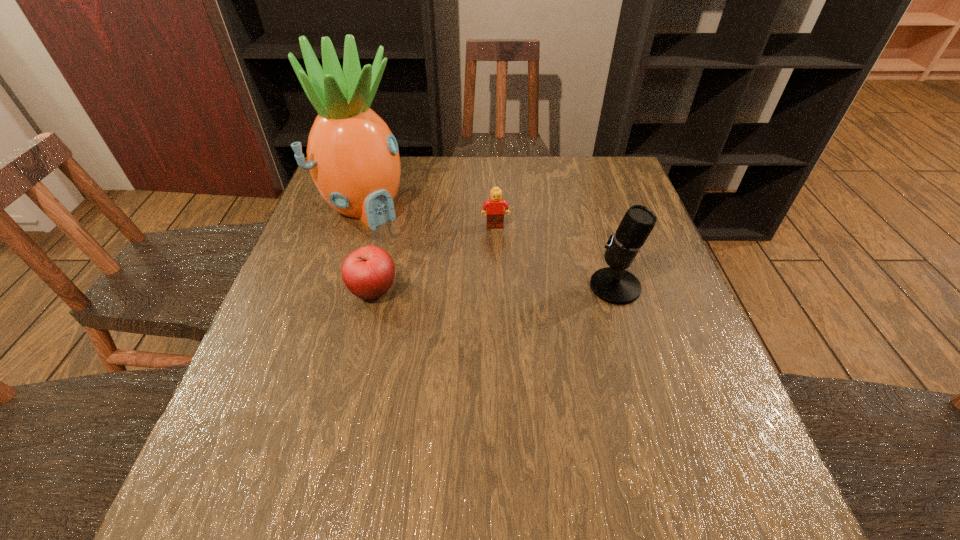
Find the location of a particular element. This screenshot has width=960, height=540. free space at the right edge of the desktop is located at coordinates (626, 348).

Where is `vacant space at the far right corner of the desktop`? The height and width of the screenshot is (540, 960). vacant space at the far right corner of the desktop is located at coordinates (592, 180).

I want to click on blank region between the apple and the Lego, so click(x=434, y=259).

This screenshot has height=540, width=960. I want to click on vacant space that's between the apple and the third object from left to right, so click(434, 259).

At what (x,y) coordinates should I click in order to perform the action: click on free space that is in between the Lego and the microphone. Please return your answer as a coordinate pair (x, y). The image size is (960, 540). Looking at the image, I should click on (555, 256).

Identify the location of free area in between the microphone and the apple. This screenshot has height=540, width=960. (494, 289).

The width and height of the screenshot is (960, 540). Identify the location of free space between the second object from right to left and the apple. (434, 259).

Find the location of a particular element. This screenshot has height=540, width=960. free space between the microphone and the tallest object is located at coordinates (490, 245).

Find the location of a particular element. The width and height of the screenshot is (960, 540). vacant space that's between the tallest object and the second object from right to left is located at coordinates (430, 215).

Identify which object is the second nearest to the pineapple. Please provide its 2D coordinates. Your answer should be formatted as a tuple, i.e. [(x, y)], where the tuple contains the x and y coordinates of a point satisfying the conditions above.

[(495, 212)]